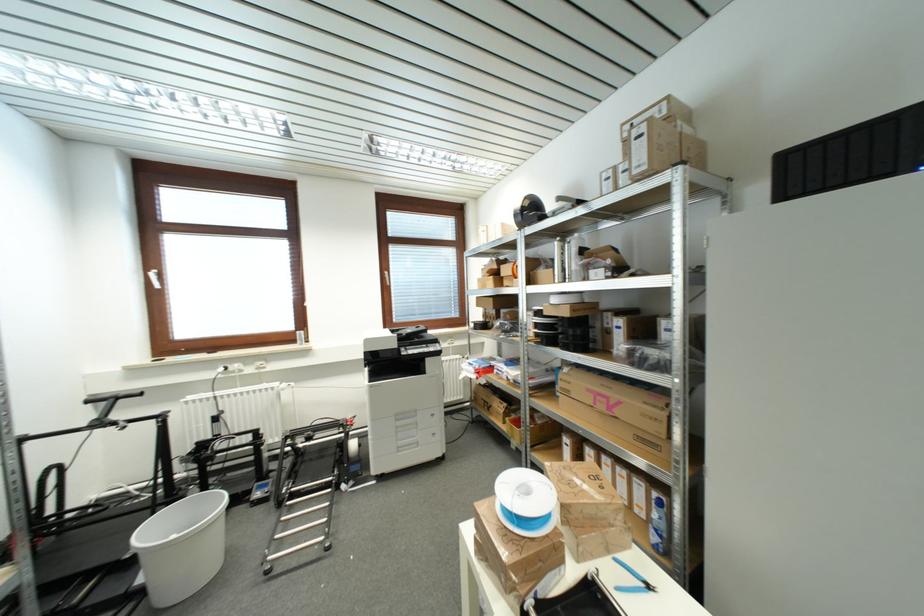
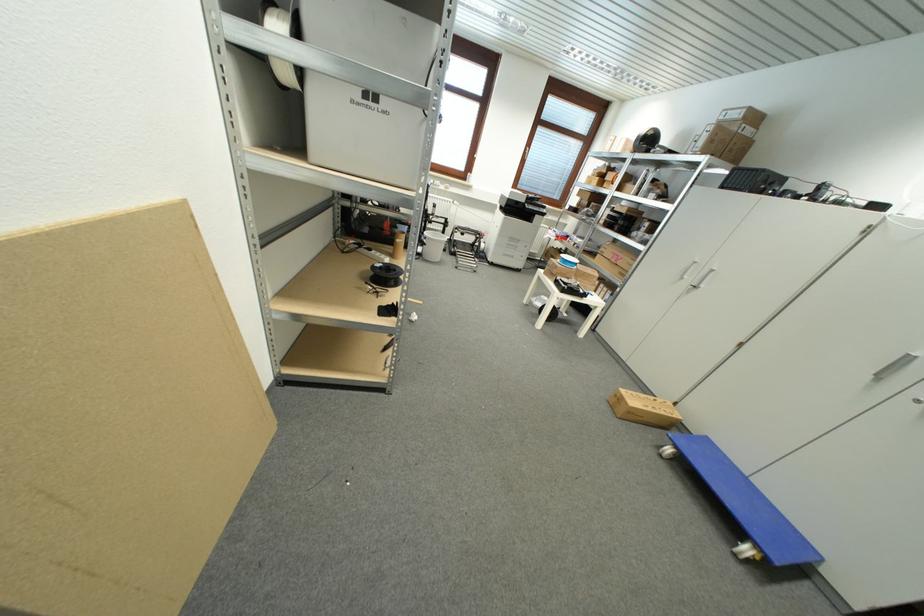
The point at (614, 410) is marked in the first image. Where is the corresponding point in the second image?

(621, 262)